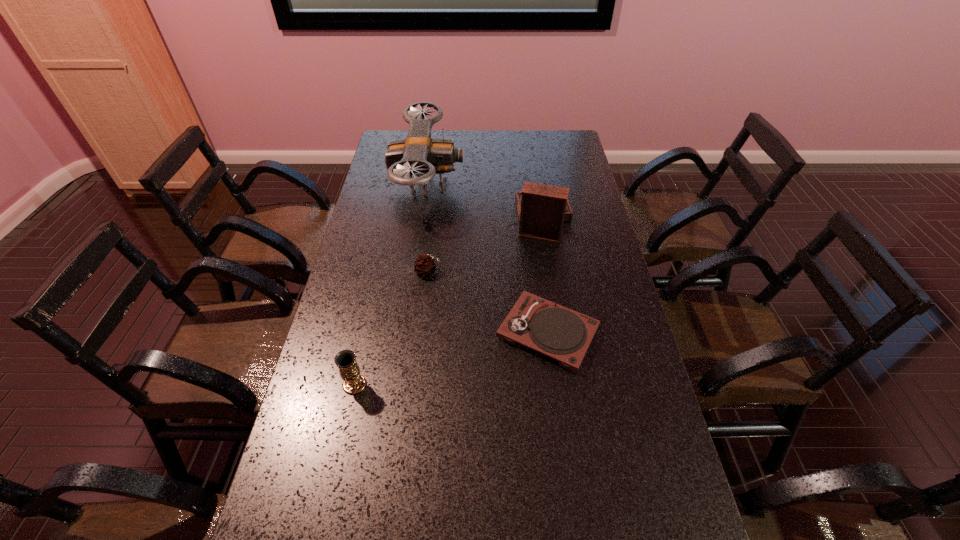
Where is `drone`? The image size is (960, 540). drone is located at coordinates (418, 155).

This screenshot has height=540, width=960. I want to click on the farther phonograph_record, so click(542, 209).

Image resolution: width=960 pixels, height=540 pixels. I want to click on the taller phonograph_record, so click(x=542, y=209).

Find the location of `chalice`. chalice is located at coordinates (345, 360).

Find the location of a particular element. This screenshot has height=540, width=960. the third nearest object is located at coordinates (425, 265).

This screenshot has width=960, height=540. I want to click on pinecone, so click(x=425, y=265).

Find the location of a particular element. the nearer phonograph_record is located at coordinates (560, 333).

Identify the location of the shorter phonograph_record. The height and width of the screenshot is (540, 960). (560, 333).

You are a GUI agent. You are given a task and a screenshot of the screen. Output one action in this format:
    pyautogui.click(x=<x>, y=<y>)
    Task: Click on the vacant region located 0.080m on the front-facing side of the tallest object
    
    Given the screenshot: What is the action you would take?
    pyautogui.click(x=485, y=185)

I want to click on free space located 0.360m on the back of the farther phonograph_record, so click(x=528, y=150).